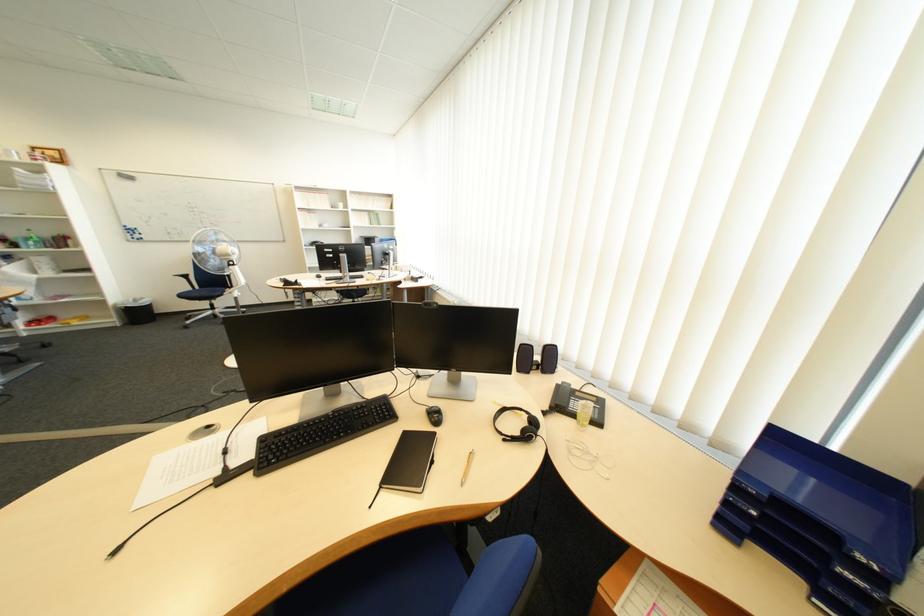
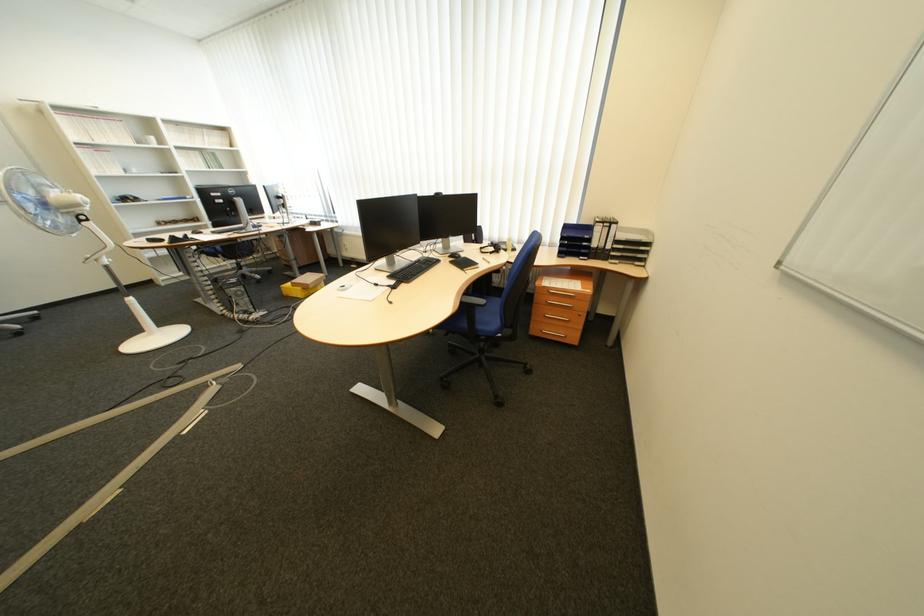
Find the pixel in the second image that matches pixel 517 411 in the first image.

(494, 249)